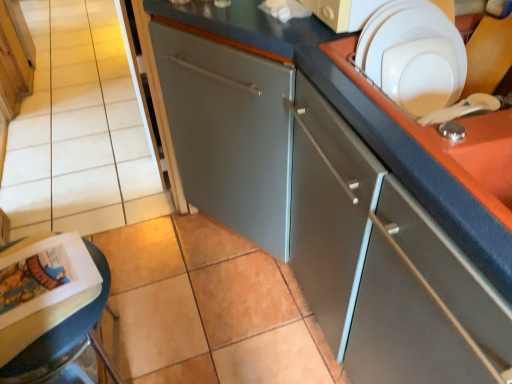
Question: From a real-world perspective, is white glossy plate at upper right over matte wood cabinet at upper left, marked as the 2th cabinetry in a front-to-back arrangement?

Choices:
 (A) yes
 (B) no

Answer: (A)

Question: Can you confirm if white glossy plate at upper right is thinner than matte wood cabinet at upper left, the first cabinetry from the back?

Choices:
 (A) yes
 (B) no

Answer: (A)

Question: Would you say white glossy plate at upper right is a long distance from matte wood cabinet at upper left, acting as the 2th cabinetry starting from the right?

Choices:
 (A) no
 (B) yes

Answer: (B)

Question: Is white glossy plate at upper right at the right side of matte wood cabinet at upper left, the first cabinetry viewed from the left?

Choices:
 (A) yes
 (B) no

Answer: (A)

Question: Is white glossy plate at upper right oriented away from matte wood cabinet at upper left, placed as the second cabinetry when sorted from bottom to top?

Choices:
 (A) yes
 (B) no

Answer: (B)

Question: Relative to matte paper magazine at lower left, is matte wood cabinet at upper left, the first cabinetry from the back, in front or behind?

Choices:
 (A) front
 (B) behind

Answer: (B)

Question: Looking at their shapes, would you say matte wood cabinet at upper left, the first cabinetry viewed from the left, is wider or thinner than matte paper magazine at lower left?

Choices:
 (A) thin
 (B) wide

Answer: (A)

Question: Would you say matte wood cabinet at upper left, marked as the 2th cabinetry in a front-to-back arrangement, is to the left or to the right of matte paper magazine at lower left in the picture?

Choices:
 (A) right
 (B) left

Answer: (B)

Question: Considering the positions of point (22, 67) and point (45, 327), is point (22, 67) closer or farther from the camera than point (45, 327)?

Choices:
 (A) farther
 (B) closer

Answer: (A)

Question: Is white glossy plate at upper right inside or outside of matte wood cabinet at upper left, acting as the 2th cabinetry starting from the right?

Choices:
 (A) inside
 (B) outside

Answer: (B)

Question: From the image's perspective, is white glossy plate at upper right above or below matte wood cabinet at upper left, the 1th cabinetry viewed from the top?

Choices:
 (A) below
 (B) above

Answer: (A)

Question: Considering their positions, is white glossy plate at upper right located in front of or behind matte wood cabinet at upper left, marked as the 2th cabinetry in a front-to-back arrangement?

Choices:
 (A) front
 (B) behind

Answer: (A)

Question: Considering the positions of white glossy plate at upper right and matte wood cabinet at upper left, marked as the 2th cabinetry in a front-to-back arrangement, in the image, is white glossy plate at upper right wider or thinner than matte wood cabinet at upper left, marked as the 2th cabinetry in a front-to-back arrangement,?

Choices:
 (A) thin
 (B) wide

Answer: (A)

Question: Considering the positions of point (20, 329) and point (402, 137), is point (20, 329) closer or farther from the camera than point (402, 137)?

Choices:
 (A) farther
 (B) closer

Answer: (A)

Question: In the image, is matte paper magazine at lower left positioned in front of or behind satin gray cabinet at center, which is counted as the 1th cabinetry, starting from the bottom?

Choices:
 (A) behind
 (B) front

Answer: (B)